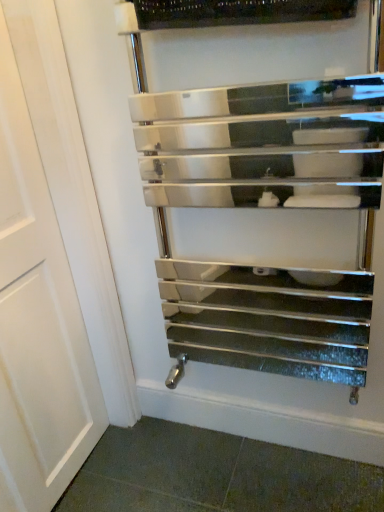
Question: Can you confirm if polished chrome towel rack at center is wider than white matte door at center?

Choices:
 (A) yes
 (B) no

Answer: (A)

Question: Is polished chrome towel rack at center outside white matte door at center?

Choices:
 (A) no
 (B) yes

Answer: (B)

Question: From a real-world perspective, is polished chrome towel rack at center physically above white matte door at center?

Choices:
 (A) no
 (B) yes

Answer: (B)

Question: Can you confirm if polished chrome towel rack at center is positioned to the left of white matte door at center?

Choices:
 (A) no
 (B) yes

Answer: (A)

Question: From the image's perspective, is polished chrome towel rack at center on top of white matte door at center?

Choices:
 (A) yes
 (B) no

Answer: (A)

Question: Considering the relative sizes of polished chrome towel rack at center and white matte door at center in the image provided, is polished chrome towel rack at center bigger than white matte door at center?

Choices:
 (A) yes
 (B) no

Answer: (A)

Question: Can you confirm if white matte door at center is smaller than polished chrome towel rack at center?

Choices:
 (A) no
 (B) yes

Answer: (B)

Question: Is white matte door at center behind polished chrome towel rack at center?

Choices:
 (A) no
 (B) yes

Answer: (A)

Question: From the image's perspective, is white matte door at center located above polished chrome towel rack at center?

Choices:
 (A) yes
 (B) no

Answer: (B)

Question: Does white matte door at center have a greater height compared to polished chrome towel rack at center?

Choices:
 (A) yes
 (B) no

Answer: (A)

Question: Is white matte door at center wider than polished chrome towel rack at center?

Choices:
 (A) yes
 (B) no

Answer: (B)

Question: Is polished chrome towel rack at center at the back of white matte door at center?

Choices:
 (A) yes
 (B) no

Answer: (B)

Question: From the image's perspective, relative to polished chrome towel rack at center, is white matte door at center above or below?

Choices:
 (A) above
 (B) below

Answer: (B)